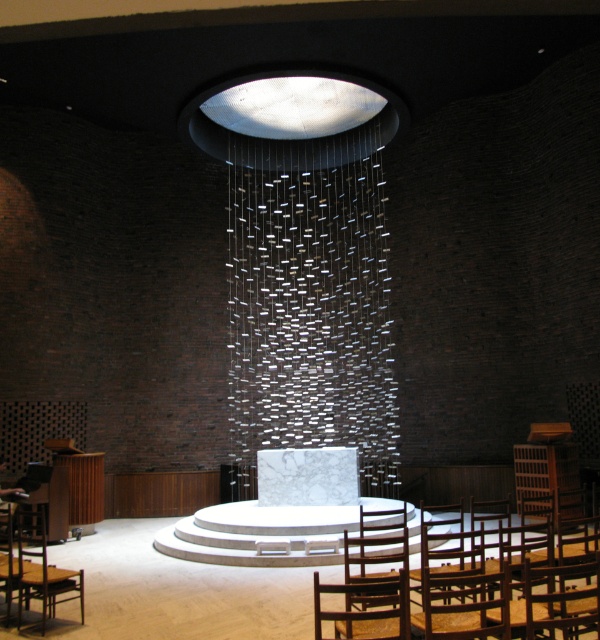
You are a visitor entering the chapel and need to choose between the wooden textured chair at lower right and the wooden chair at lower left. Which chair has a wider seat to sit on?

The wooden textured chair at lower right has a wider seat than the wooden chair at lower left, so it is more suitable for sitting comfortably.

You are standing at the entrance of the modern minimalist church and want to sit down. The wooden chair at lower center is your only option. Can you reach it without moving any other objects?

The wooden chair at lower center is positioned at point (366, 609), so yes, you can reach it without moving any other objects as there are no other objects mentioned in the scene obstructing the path.

In the scene shown: You are a visitor to the church and need to sit down. You see a wooden textured chair at lower right and a wooden chair at lower center. Which chair is taller?

The wooden textured chair at lower right is taller than the wooden chair at lower center.